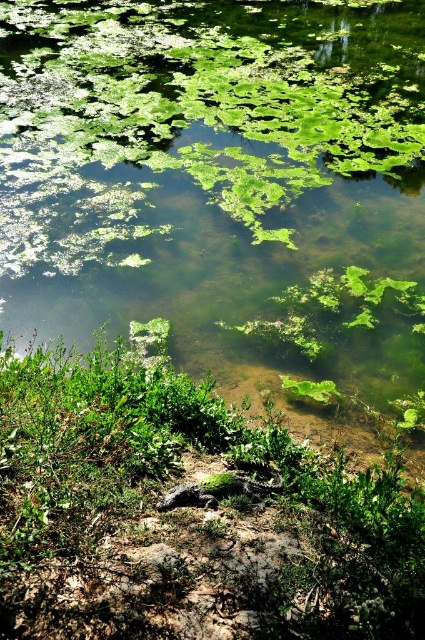
You are a small frog that can jump 20 feet. You are currently on the green algae at bottom and want to reach the other side of the water. Can you jump to the other side?

The green algae at bottom is 22.80 feet away from the other side of the water. Since the frog can only jump 20 feet, it cannot reach the other side in a single jump.

You are a small frog trying to jump from the green leafy plant at center to the green algae at bottom. Can you safely make the jump without falling into the water?

The green algae at bottom might be wider than green leafy plant at center, so the frog can safely jump as the algae provides a larger landing area.

You are a frog trying to jump from the green algae at bottom to the green leafy plant at center. Based on the scene, can you reach the plant without getting wet?

The green algae at bottom is above the green leafy plant at center, so the frog can jump from the green algae at bottom to the green leafy plant at center without getting wet because the algae is positioned higher.